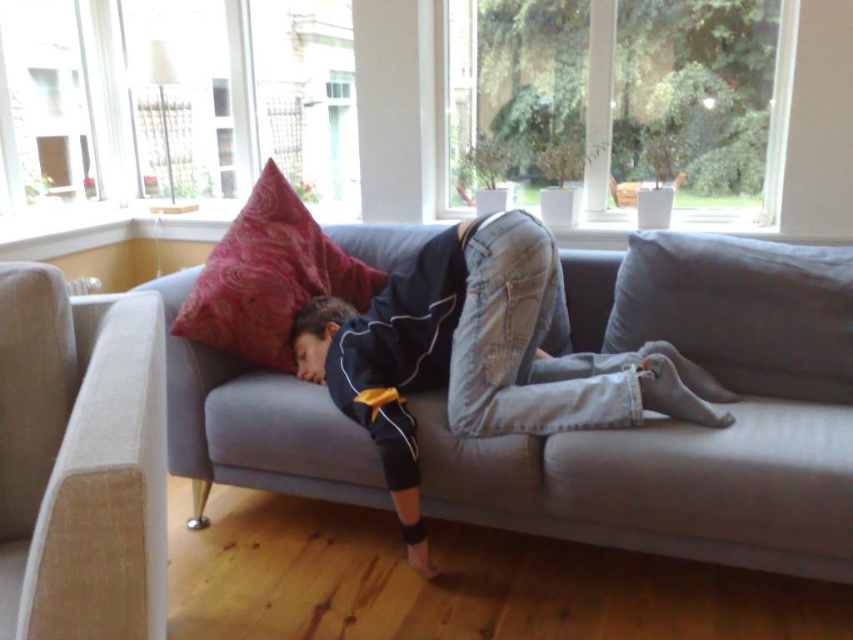
Question: Considering the real-world distances, which object is farthest from the beige fabric couch at lower left?

Choices:
 (A) velvet red pillow at upper left
 (B) matte gray couch at center

Answer: (B)

Question: Does beige fabric couch at lower left have a lesser width compared to velvet red pillow at upper left?

Choices:
 (A) no
 (B) yes

Answer: (B)

Question: Which of these objects is positioned farthest from the velvet red pillow at upper left?

Choices:
 (A) matte gray couch at center
 (B) beige fabric couch at lower left

Answer: (B)

Question: Can you confirm if matte gray couch at center is positioned below beige fabric couch at lower left?

Choices:
 (A) yes
 (B) no

Answer: (B)

Question: Considering the relative positions of matte gray couch at center and beige fabric couch at lower left in the image provided, where is matte gray couch at center located with respect to beige fabric couch at lower left?

Choices:
 (A) below
 (B) above

Answer: (B)

Question: Which point is closer to the camera?

Choices:
 (A) (61, 445)
 (B) (201, 346)
 (C) (355, 284)

Answer: (A)